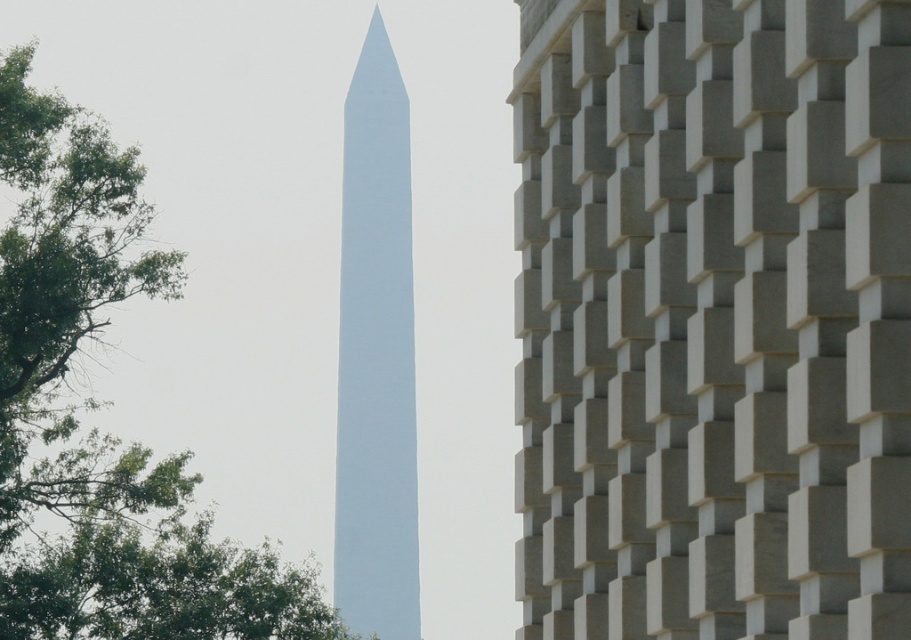
Question: Among these objects, which one is nearest to the camera?

Choices:
 (A) white smooth tower at center
 (B) green leafy tree at left
 (C) gray concrete blocks at center

Answer: (C)

Question: Which object is positioned farthest from the white smooth tower at center?

Choices:
 (A) green leafy tree at left
 (B) gray concrete blocks at center

Answer: (B)

Question: Is green leafy tree at left positioned at the back of white smooth tower at center?

Choices:
 (A) no
 (B) yes

Answer: (A)

Question: Is the position of gray concrete blocks at center less distant than that of green leafy tree at left?

Choices:
 (A) no
 (B) yes

Answer: (B)

Question: Which of the following is the farthest from the observer?

Choices:
 (A) (351, 499)
 (B) (858, 99)

Answer: (A)

Question: Can you confirm if gray concrete blocks at center is positioned above white smooth tower at center?

Choices:
 (A) yes
 (B) no

Answer: (A)